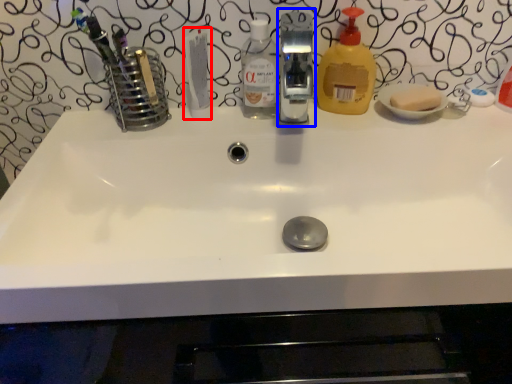
Question: Among these objects, which one is nearest to the camera, toothpaste (highlighted by a red box) or fixture (highlighted by a blue box)?

Choices:
 (A) toothpaste
 (B) fixture

Answer: (B)